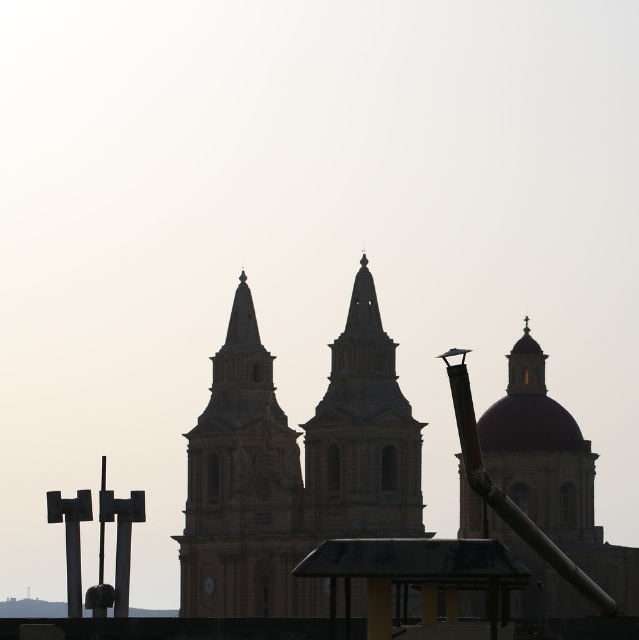
Question: Is beige stone church at center to the right of beige stone tower at center from the viewer's perspective?

Choices:
 (A) yes
 (B) no

Answer: (A)

Question: Can you confirm if beige stone church at center is positioned below beige stone tower at center?

Choices:
 (A) no
 (B) yes

Answer: (A)

Question: Which object is closer to the camera taking this photo?

Choices:
 (A) beige stone tower at center
 (B) beige stone church at center

Answer: (B)

Question: Among these points, which one is farthest from the camera?

Choices:
 (A) (242, 483)
 (B) (208, 452)

Answer: (B)

Question: Which of the following is the farthest from the observer?

Choices:
 (A) beige stone church at center
 (B) beige stone tower at center

Answer: (B)

Question: Is beige stone church at center wider than beige stone tower at center?

Choices:
 (A) no
 (B) yes

Answer: (B)